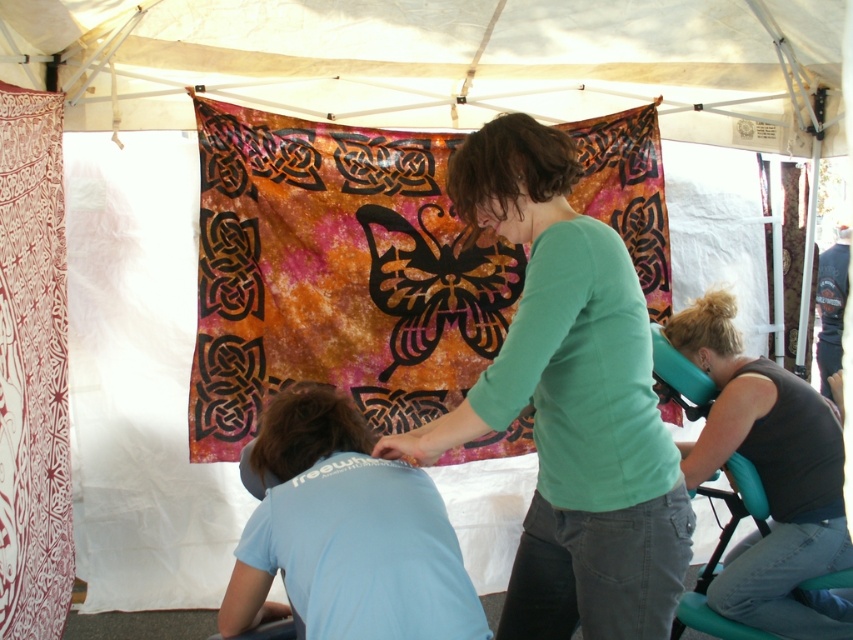
Is white fabric canopy at upper center to the left of batik fabric butterfly at center from the viewer's perspective?

Incorrect, white fabric canopy at upper center is not on the left side of batik fabric butterfly at center.

Between white fabric canopy at upper center and batik fabric butterfly at center, which one appears on the left side from the viewer's perspective?

batik fabric butterfly at center

Between point (456, 12) and point (224, 438), which one is positioned in front?

Point (456, 12) is in front.

Identify the location of white fabric canopy at upper center. Image resolution: width=853 pixels, height=640 pixels. (439, 61).

Measure the distance between batik fabric butterfly at center and light blue fabric at center.

batik fabric butterfly at center is 1.31 meters away from light blue fabric at center.

Measure the distance from batik fabric butterfly at center to light blue fabric at center.

batik fabric butterfly at center and light blue fabric at center are 1.31 meters apart.

Locate an element on the screen. batik fabric butterfly at center is located at coordinates (335, 273).

Find the location of a particular element. batik fabric butterfly at center is located at coordinates (335, 273).

Is light blue fabric at center in front of teal plastic chair at lower right?

Yes.

Does light blue fabric at center come behind teal plastic chair at lower right?

No, it is not.

Does point (247, 573) come farther from viewer compared to point (714, 397)?

No, it is in front of (714, 397).

Identify the location of light blue fabric at center. The height and width of the screenshot is (640, 853). (345, 532).